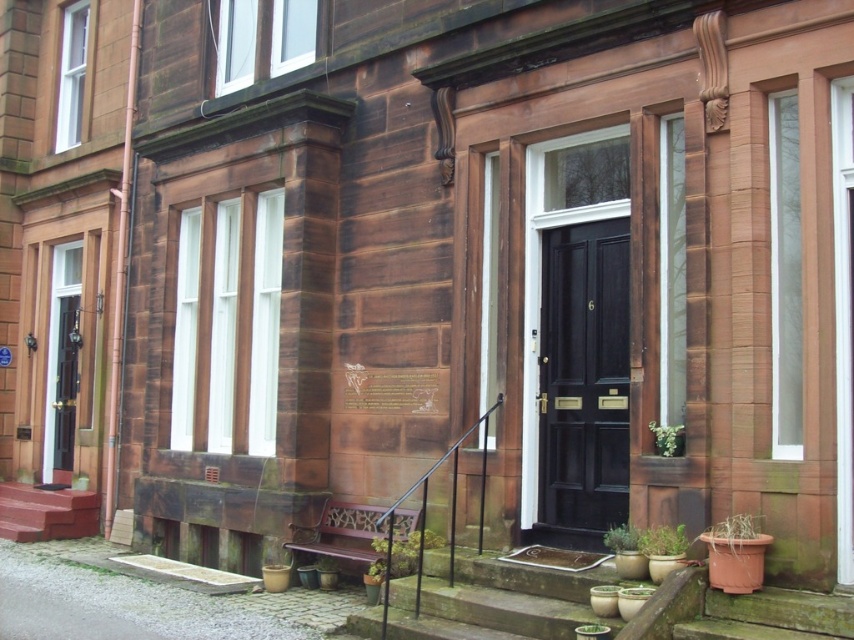
Is black glossy door at center in front of smooth red stairs at lower left?

Yes, it is.

Can you confirm if black glossy door at center is positioned to the right of smooth red stairs at lower left?

Yes, black glossy door at center is to the right of smooth red stairs at lower left.

Is point (619, 323) less distant than point (21, 538)?

Yes, point (619, 323) is in front of point (21, 538).

The image size is (854, 640). I want to click on black glossy door at center, so click(583, 381).

Who is more forward, (63, 490) or (661, 541)?

Point (661, 541) is more forward.

Which is behind, point (26, 493) or point (647, 538)?

Positioned behind is point (26, 493).

Is point (92, 499) in front of point (662, 547)?

No, it is not.

Identify the location of smooth red stairs at lower left. (45, 513).

At what (x,y) coordinates should I click in order to perform the action: click on green leafy plant at bottom center. Please return your answer as a coordinate pair (x, y). The height and width of the screenshot is (640, 854). Looking at the image, I should click on (402, 552).

The image size is (854, 640). Find the location of `green leafy plant at bottom center`. green leafy plant at bottom center is located at coordinates (402, 552).